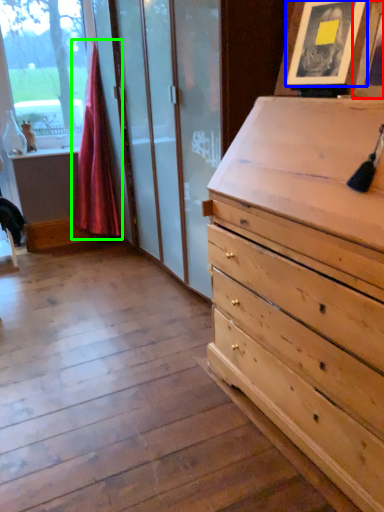
Question: Estimate the real-world distances between objects in this image. Which object is farther from picture frame (highlighted by a red box), picture frame (highlighted by a blue box) or curtain (highlighted by a green box)?

Choices:
 (A) picture frame
 (B) curtain

Answer: (B)